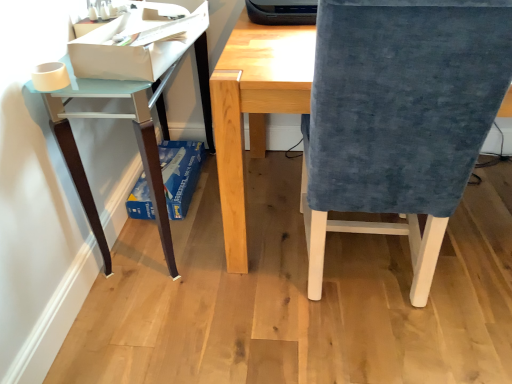
Question: Is the depth of velvet blue chair at right less than that of blue cardboard box at lower left, the first paperback book positioned from the back?

Choices:
 (A) no
 (B) yes

Answer: (B)

Question: Does velvet blue chair at right appear on the left side of blue cardboard box at lower left, the first paperback book positioned from the back?

Choices:
 (A) no
 (B) yes

Answer: (A)

Question: Is velvet blue chair at right completely or partially outside of blue cardboard box at lower left, the second paperback book from the front?

Choices:
 (A) no
 (B) yes

Answer: (B)

Question: From a real-world perspective, is velvet blue chair at right under blue cardboard box at lower left, the second paperback book from the front?

Choices:
 (A) yes
 (B) no

Answer: (B)

Question: From a real-world perspective, is velvet blue chair at right on top of blue cardboard box at lower left, the 1th paperback book from the bottom?

Choices:
 (A) no
 (B) yes

Answer: (B)

Question: Does velvet blue chair at right touch blue cardboard box at lower left, which ranks as the 2th paperback book in top-to-bottom order?

Choices:
 (A) no
 (B) yes

Answer: (A)

Question: Is light blue glossy table at left positioned with its back to white paper at upper left, arranged as the 1th paperback book when viewed from the front?

Choices:
 (A) no
 (B) yes

Answer: (A)

Question: Does light blue glossy table at left have a larger size compared to white paper at upper left, which ranks as the 2th paperback book in bottom-to-top order?

Choices:
 (A) yes
 (B) no

Answer: (A)

Question: Is light blue glossy table at left thinner than white paper at upper left, arranged as the 1th paperback book when viewed from the front?

Choices:
 (A) no
 (B) yes

Answer: (A)

Question: From a real-world perspective, is light blue glossy table at left over white paper at upper left, positioned as the second paperback book in back-to-front order?

Choices:
 (A) no
 (B) yes

Answer: (A)

Question: Does light blue glossy table at left have a smaller size compared to white paper at upper left, which ranks as the 2th paperback book in bottom-to-top order?

Choices:
 (A) yes
 (B) no

Answer: (B)

Question: Is light blue glossy table at left oriented towards white paper at upper left, arranged as the 1th paperback book when viewed from the front?

Choices:
 (A) no
 (B) yes

Answer: (A)

Question: Does velvet blue chair at right have a smaller size compared to light blue glossy table at left?

Choices:
 (A) yes
 (B) no

Answer: (B)